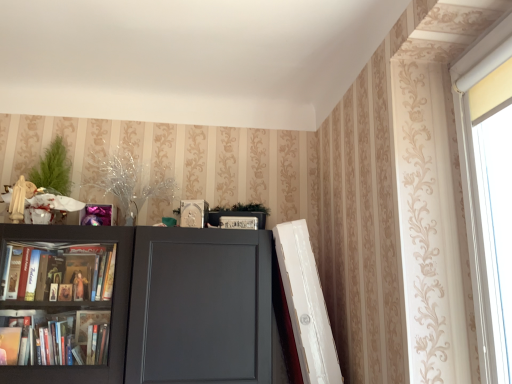
Question: Should I look upward or downward to see white plastic window at upper right?

Choices:
 (A) up
 (B) down

Answer: (B)